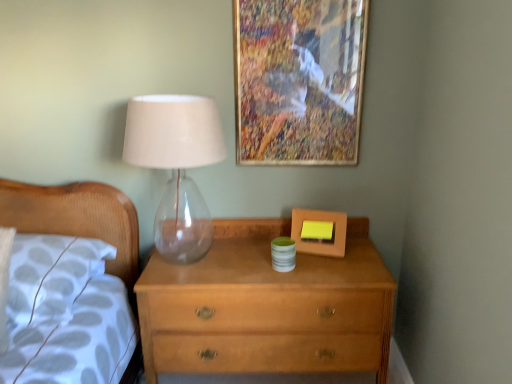
Identify the location of vacant space underneath transparent glass table lamp at left (from a real-world perspective). (189, 249).